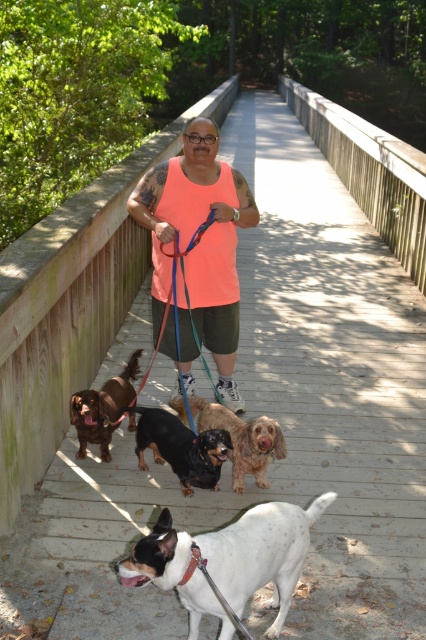
What is the position of the neon orange tank top at center relative to the brown fur dog at center?

The neon orange tank top at center is to the right of the brown fur dog at center.

You are a photographer standing on the wooden bridge. You want to capture a photo of the two dogs with their distinct fur colors. Which dog has a wider body, the white speckled fur at center or the shiny brown fur at center?

The white speckled fur at center has a wider body than the shiny brown fur at center.

You are standing on the wooden bridge and see two points marked on the bridge surface. The first point is at coordinates point (x=224, y=589) and the second is at point (x=181, y=417). Which point is closer to the man walking the dogs?

Point (x=224, y=589) is closer to the man walking the dogs because it is in front of point (x=181, y=417).